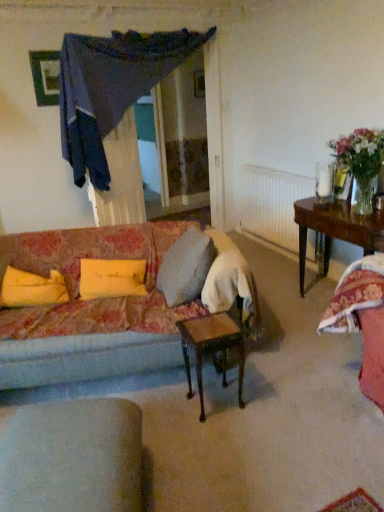
Question: From the image's perspective, is wooden table at center, marked as the 1th table in a front-to-back arrangement, located above dark blue fabric at upper center?

Choices:
 (A) no
 (B) yes

Answer: (A)

Question: Does wooden table at center, marked as the 1th table in a front-to-back arrangement, lie behind dark blue fabric at upper center?

Choices:
 (A) no
 (B) yes

Answer: (A)

Question: From a real-world perspective, is wooden table at center, acting as the second table starting from the back, located higher than dark blue fabric at upper center?

Choices:
 (A) yes
 (B) no

Answer: (B)

Question: Is wooden table at center, marked as the 1th table in a front-to-back arrangement, shorter than dark blue fabric at upper center?

Choices:
 (A) no
 (B) yes

Answer: (B)

Question: Does wooden table at center, acting as the second table starting from the back, have a greater height compared to dark blue fabric at upper center?

Choices:
 (A) no
 (B) yes

Answer: (A)

Question: Is wooden table at center, marked as the 1th table in a front-to-back arrangement, far from dark blue fabric at upper center?

Choices:
 (A) no
 (B) yes

Answer: (B)

Question: Is yellow fabric pillow at center, the 2th pillow positioned from the left, thinner than light gray fabric chair at lower left?

Choices:
 (A) no
 (B) yes

Answer: (B)

Question: Is yellow fabric pillow at center, the 2th pillow positioned from the left, directly adjacent to light gray fabric chair at lower left?

Choices:
 (A) yes
 (B) no

Answer: (B)

Question: Does yellow fabric pillow at center, acting as the first pillow starting from the right, have a larger size compared to light gray fabric chair at lower left?

Choices:
 (A) no
 (B) yes

Answer: (A)

Question: Would you say light gray fabric chair at lower left is part of yellow fabric pillow at center, the 2th pillow positioned from the left,'s contents?

Choices:
 (A) yes
 (B) no

Answer: (B)

Question: From a real-world perspective, is yellow fabric pillow at center, the 2th pillow positioned from the left, on top of light gray fabric chair at lower left?

Choices:
 (A) no
 (B) yes

Answer: (B)

Question: Would you consider yellow fabric pillow at center, acting as the first pillow starting from the right, to be distant from light gray fabric chair at lower left?

Choices:
 (A) yes
 (B) no

Answer: (A)

Question: Can you confirm if translucent glass vase at upper right is smaller than white textured radiator at center?

Choices:
 (A) no
 (B) yes

Answer: (A)